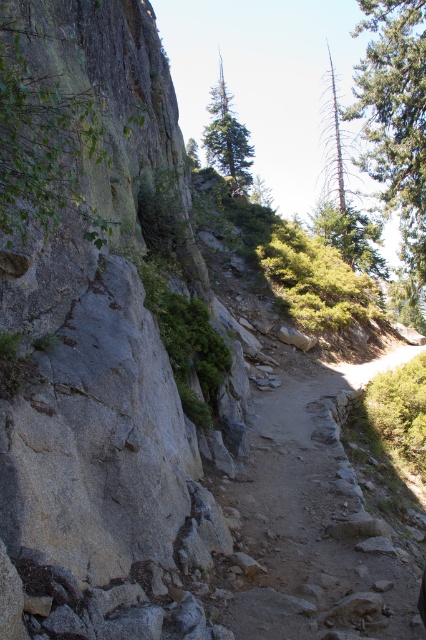
Question: Does dirt path at center lie behind green textured pine at upper center?

Choices:
 (A) no
 (B) yes

Answer: (A)

Question: Is dirt path at center to the left of green textured pine at upper center from the viewer's perspective?

Choices:
 (A) yes
 (B) no

Answer: (B)

Question: Which object is closer to the camera taking this photo?

Choices:
 (A) green textured pine at upper center
 (B) dirt path at center

Answer: (B)

Question: Among these points, which one is farthest from the camera?

Choices:
 (A) (244, 163)
 (B) (394, 552)

Answer: (A)

Question: Is the position of dirt path at center less distant than that of green textured pine at upper center?

Choices:
 (A) no
 (B) yes

Answer: (B)

Question: Which of the following is the farthest from the observer?

Choices:
 (A) (224, 113)
 (B) (285, 609)

Answer: (A)